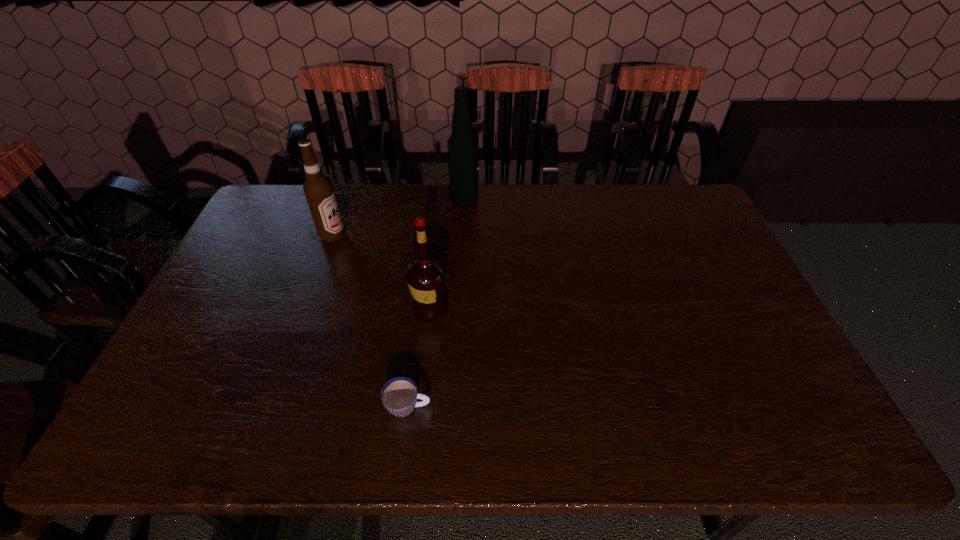
Find the location of a particular element. The image size is (960, 540). alcohol that is the second nearest to the leftmost object is located at coordinates (463, 147).

Where is `alcohol that is the closest to the tallest object`? This screenshot has width=960, height=540. alcohol that is the closest to the tallest object is located at coordinates (318, 189).